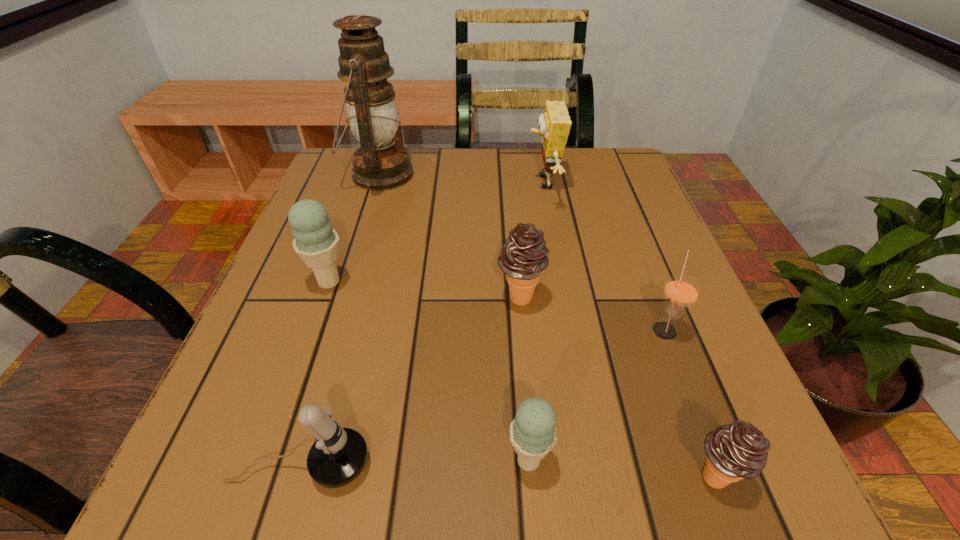
This screenshot has width=960, height=540. Identify the location of free point between the smaller blue ice cream and the bigger chocolate icecream. (524, 379).

Locate an element on the screen. Image resolution: width=960 pixels, height=540 pixels. free space between the left chocolate icecream and the smaller chocolate icecream is located at coordinates (616, 387).

I want to click on vacant space that's between the lantern and the sponge, so click(461, 179).

The height and width of the screenshot is (540, 960). I want to click on free space between the nearer chocolate icecream and the farther chocolate icecream, so click(x=616, y=387).

You are a GUI agent. You are given a task and a screenshot of the screen. Output one action in this format:
    pyautogui.click(x=<x>, y=<y>)
    Task: Click on the unoccupied position between the microphone and the right chocolate icecream
    Image resolution: width=960 pixels, height=540 pixels.
    Given the screenshot: What is the action you would take?
    pyautogui.click(x=507, y=470)

Image resolution: width=960 pixels, height=540 pixels. I want to click on vacant region between the farther chocolate icecream and the smaller blue ice cream, so click(524, 379).

Where is `vacant point located between the smaller blue ice cream and the microphone`? vacant point located between the smaller blue ice cream and the microphone is located at coordinates (415, 463).

At what (x,y) coordinates should I click in order to perform the action: click on object identified as the fourth closest to the fifth farthest object. Please return your answer as a coordinate pair (x, y). Looking at the image, I should click on (554, 124).

Point out which object is positioned as the fifth nearest to the leftmost icecream. Please provide its 2D coordinates. Your answer should be formatted as a tuple, i.e. [(x, y)], where the tuple contains the x and y coordinates of a point satisfying the conditions above.

[(554, 124)]

Select which icecream appears as the closest to the right chocolate icecream. Please provide its 2D coordinates. Your answer should be formatted as a tuple, i.e. [(x, y)], where the tuple contains the x and y coordinates of a point satisfying the conditions above.

[(533, 434)]